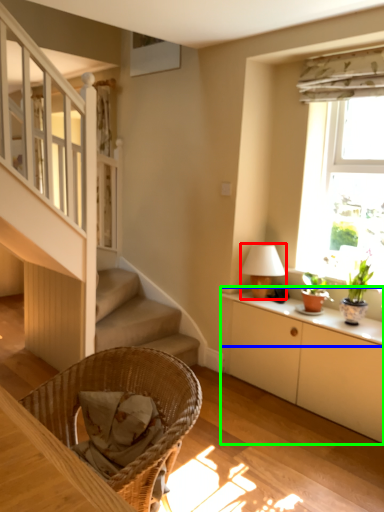
Question: Which object is the farthest from table lamp (highlighted by a red box)? Choose among these: window sill (highlighted by a blue box) or cabinetry (highlighted by a green box).

Choices:
 (A) window sill
 (B) cabinetry

Answer: (B)